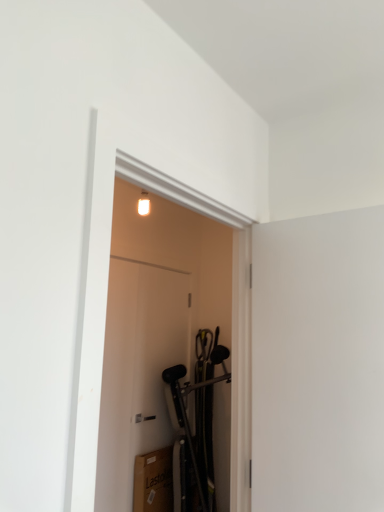
Question: Is white matte door at center, which is counted as the 1th door, starting from the back, aimed at white glossy door at center, which is the first door from front to back?

Choices:
 (A) yes
 (B) no

Answer: (B)

Question: Is white matte door at center, which is counted as the 1th door, starting from the back, smaller than white glossy door at center, acting as the second door starting from the back?

Choices:
 (A) yes
 (B) no

Answer: (A)

Question: From a real-world perspective, is white matte door at center, which is counted as the 1th door, starting from the back, under white glossy door at center, acting as the second door starting from the back?

Choices:
 (A) no
 (B) yes

Answer: (B)

Question: Is white matte door at center, which is counted as the 1th door, starting from the back, thinner than white glossy door at center, which is the first door from front to back?

Choices:
 (A) yes
 (B) no

Answer: (A)

Question: Is white matte door at center, which is counted as the 1th door, starting from the back, taller than white glossy door at center, which is the first door from front to back?

Choices:
 (A) yes
 (B) no

Answer: (A)

Question: Is white matte screen door at right situated inside white matte door at center, which is the second door in front-to-back order, or outside?

Choices:
 (A) inside
 (B) outside

Answer: (B)

Question: Is white matte screen door at right wider or thinner than white matte door at center, which is counted as the 1th door, starting from the back?

Choices:
 (A) thin
 (B) wide

Answer: (B)

Question: From a real-world perspective, is white matte screen door at right above or below white matte door at center, which is counted as the 1th door, starting from the back?

Choices:
 (A) below
 (B) above

Answer: (B)

Question: Does point (289, 431) appear closer or farther from the camera than point (97, 494)?

Choices:
 (A) closer
 (B) farther

Answer: (B)

Question: Choose the correct answer: Is white glossy door at center, acting as the second door starting from the back, inside white matte screen door at right or outside it?

Choices:
 (A) outside
 (B) inside

Answer: (A)

Question: From a real-world perspective, relative to white matte screen door at right, is white glossy door at center, acting as the second door starting from the back, vertically above or below?

Choices:
 (A) below
 (B) above

Answer: (B)

Question: Looking at the image, does white glossy door at center, acting as the second door starting from the back, seem bigger or smaller compared to white matte screen door at right?

Choices:
 (A) big
 (B) small

Answer: (A)

Question: Based on their positions, is white glossy door at center, acting as the second door starting from the back, located to the left or right of white matte screen door at right?

Choices:
 (A) left
 (B) right

Answer: (A)

Question: Considering the relative positions of white matte door at center, which is the second door in front-to-back order, and white matte screen door at right in the image provided, is white matte door at center, which is the second door in front-to-back order, to the left or to the right of white matte screen door at right?

Choices:
 (A) left
 (B) right

Answer: (A)

Question: Considering the positions of white matte door at center, which is the second door in front-to-back order, and white matte screen door at right in the image, is white matte door at center, which is the second door in front-to-back order, wider or thinner than white matte screen door at right?

Choices:
 (A) wide
 (B) thin

Answer: (B)